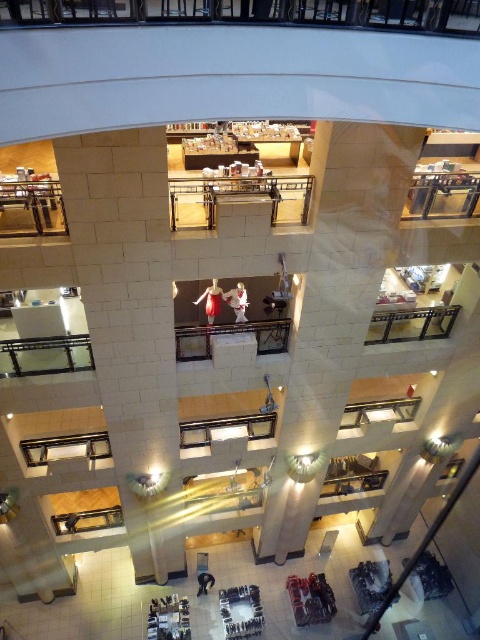
You are a customer in the shopping mall and want to see the white fabric dress at center. However, there is a white marble pillar at center blocking your view. Can you see the dress around the pillar?

The white marble pillar at center is taller than the white fabric dress at center, so the pillar will block your view of the dress. You need to move to a different position to see it.

You are a delivery person carrying a large box that is 1 meter wide. You need to navigate through the shopping mall and pass between the white marble pillar at center and the matte red dress at center. Can your box fit through the space between them?

The white marble pillar at center might be wider than the matte red dress at center. However, since the exact width of the space between them isn not specified, it is uncertain whether the 1 meter wide box can fit. You should measure the gap or choose a different path to ensure safety.